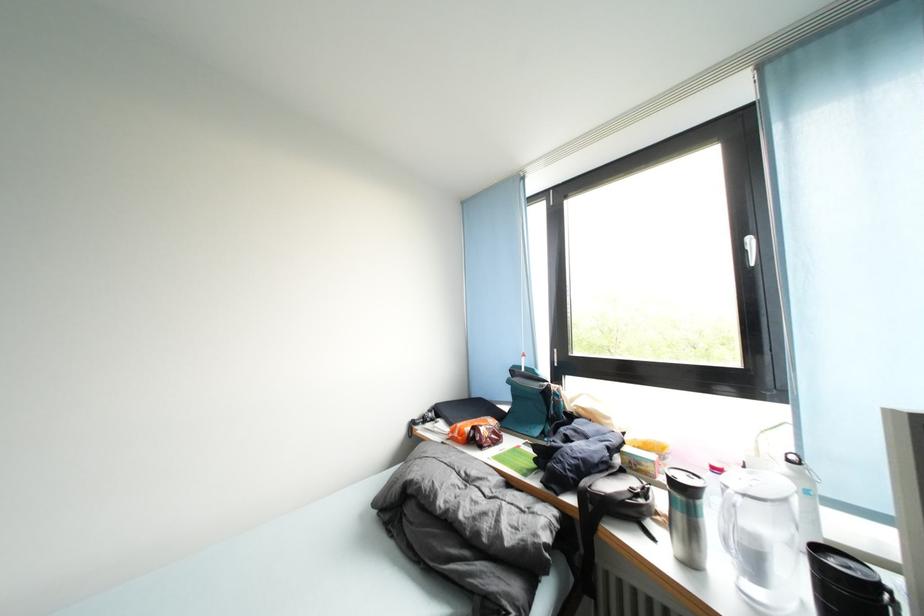
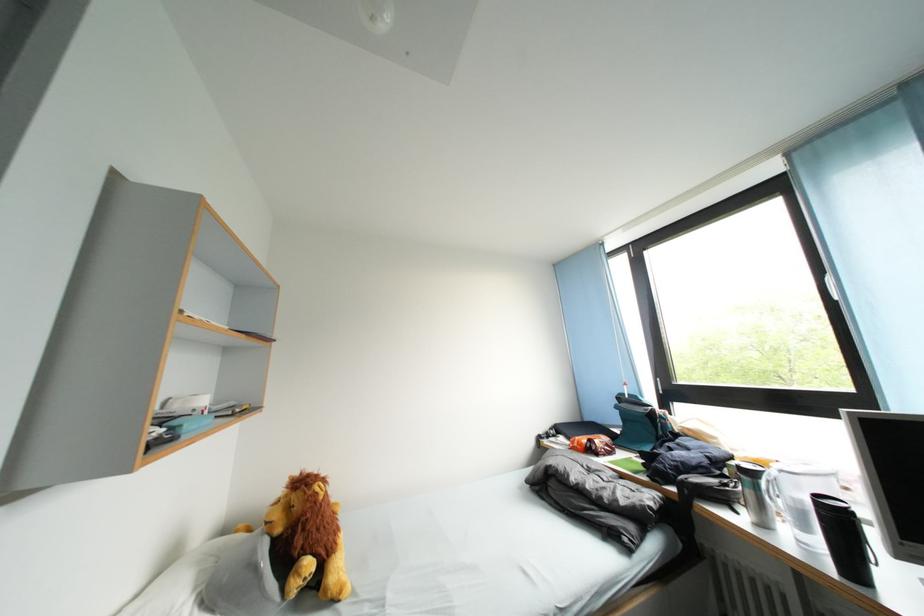
Where in the second image is the point corresponding to (x=531, y=360) from the first image?

(634, 389)